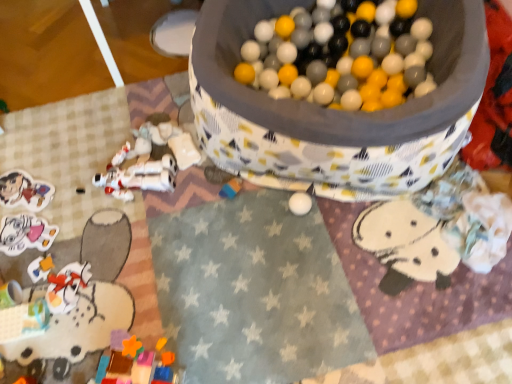
This screenshot has width=512, height=384. Find the location of `vacant area that lies between plastic toy figure at lower left, positioned as the third toy in left-to-right order, and matte cardboard sticker at lower left, which is the first toy in left-to-right order`. vacant area that lies between plastic toy figure at lower left, positioned as the third toy in left-to-right order, and matte cardboard sticker at lower left, which is the first toy in left-to-right order is located at coordinates (39, 239).